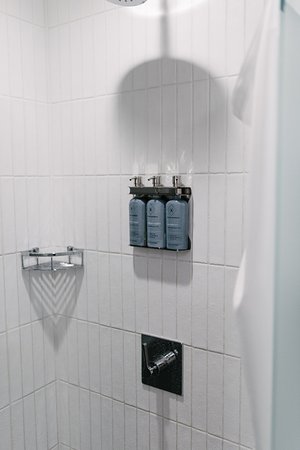
This screenshot has width=300, height=450. I want to click on shower stall, so click(103, 380).